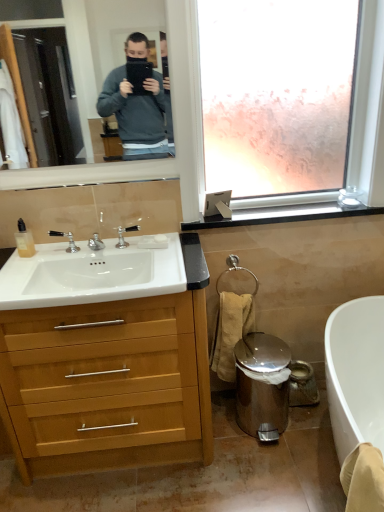
Image resolution: width=384 pixels, height=512 pixels. In order to click on vacant area to the right of translucent plastic bottle at sink left in this screenshot , I will do `click(52, 254)`.